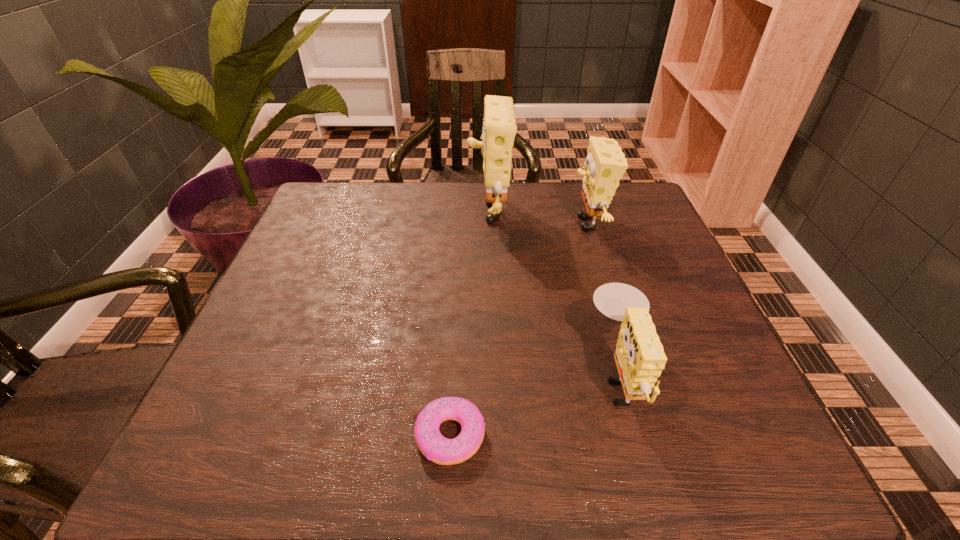
Locate an element on the screen. This screenshot has width=960, height=540. free space between the second shortest object and the tallest object is located at coordinates (554, 292).

Identify which object is the second nearest to the nearest sponge. Please provide its 2D coordinates. Your answer should be formatted as a tuple, i.e. [(x, y)], where the tuple contains the x and y coordinates of a point satisfying the conditions above.

[(605, 164)]

You are a GUI agent. You are given a task and a screenshot of the screen. Output one action in this format:
    pyautogui.click(x=<x>, y=<y>)
    Task: Click on the object that is the third closest to the doughnut
    The width and height of the screenshot is (960, 540).
    Given the screenshot: What is the action you would take?
    pyautogui.click(x=499, y=129)

Identify which sponge is the second nearest to the doughnut. Please provide its 2D coordinates. Your answer should be formatted as a tuple, i.e. [(x, y)], where the tuple contains the x and y coordinates of a point satisfying the conditions above.

[(605, 164)]

Identify the location of the second closest sponge to the tallest object. The height and width of the screenshot is (540, 960). (639, 356).

Locate an element on the screen. The width and height of the screenshot is (960, 540). free space that satisfies the following two spatial constraints: 1. on the face of the third shortest object; 2. on the front side of the doughnut is located at coordinates (655, 435).